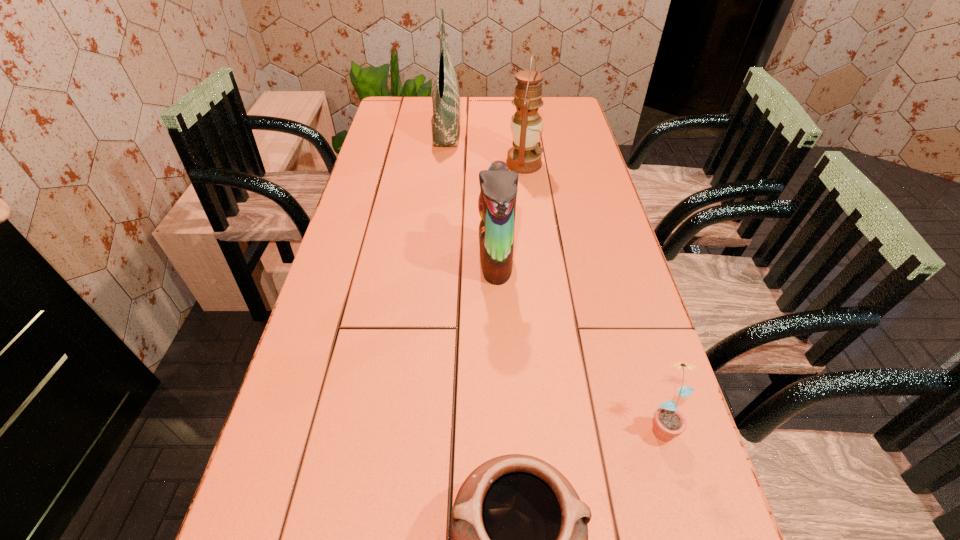
Find the location of a particular element. tote bag is located at coordinates (445, 93).

The width and height of the screenshot is (960, 540). In order to click on oil lamp in this screenshot , I will do `click(526, 125)`.

The height and width of the screenshot is (540, 960). I want to click on the third farthest object, so click(497, 201).

Identify the location of the third shortest object. (497, 201).

Image resolution: width=960 pixels, height=540 pixels. I want to click on sunflower, so click(x=669, y=422).

This screenshot has width=960, height=540. I want to click on the rightmost object, so click(669, 422).

Where is `vacant space located on the right of the leftmost object`? The image size is (960, 540). vacant space located on the right of the leftmost object is located at coordinates (526, 127).

I want to click on free location located on the back of the second tallest object, so click(520, 136).

Find the location of a particular element. The width and height of the screenshot is (960, 540). vacant area situated at the face of the parrot is located at coordinates (444, 260).

Identify the location of vacant space located 0.090m at the face of the parrot. The image size is (960, 540). (444, 260).